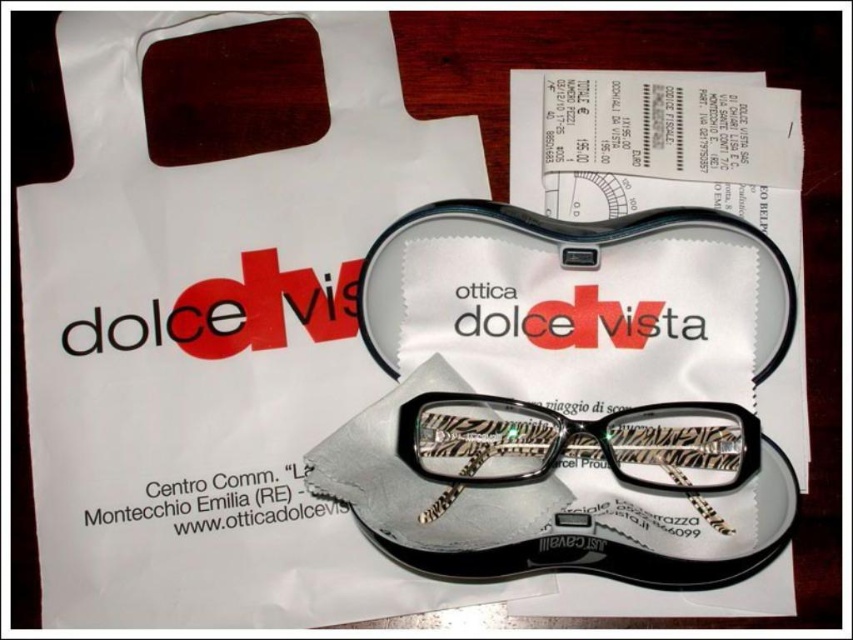
Question: Does zebra-patterned plastic glasses at center appear on the right side of black matte eyeglass case at center?

Choices:
 (A) no
 (B) yes

Answer: (A)

Question: Among these objects, which one is farthest from the camera?

Choices:
 (A) zebra-patterned plastic glasses at center
 (B) black matte eyewear case at center

Answer: (A)

Question: Can you confirm if black matte eyewear case at center is thinner than black matte eyeglass case at center?

Choices:
 (A) yes
 (B) no

Answer: (B)

Question: Which of these objects is positioned closest to the black matte eyewear case at center?

Choices:
 (A) zebra-patterned plastic glasses at center
 (B) black matte eyeglass case at center

Answer: (A)

Question: Can you confirm if black matte eyewear case at center is positioned below black matte eyeglass case at center?

Choices:
 (A) no
 (B) yes

Answer: (B)

Question: Which of the following is the closest to the observer?

Choices:
 (A) zebra-patterned plastic glasses at center
 (B) black matte eyeglass case at center
 (C) black matte eyewear case at center

Answer: (C)